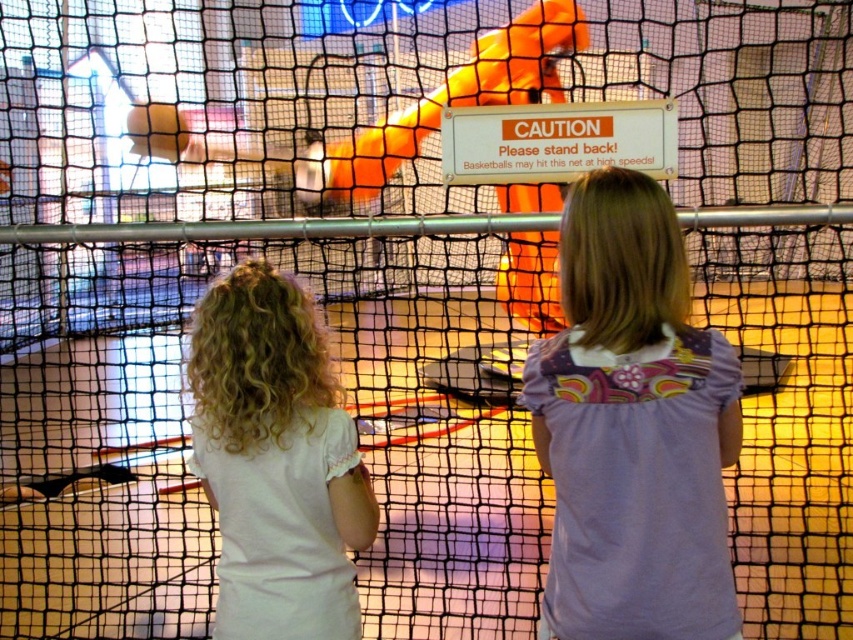
Question: Which object appears farthest from the camera in this image?

Choices:
 (A) purple floral shirt at center
 (B) white cotton shirt at center

Answer: (B)

Question: Does purple floral shirt at center appear on the right side of white cotton shirt at center?

Choices:
 (A) no
 (B) yes

Answer: (B)

Question: Is purple floral shirt at center to the left of white cotton shirt at center from the viewer's perspective?

Choices:
 (A) yes
 (B) no

Answer: (B)

Question: Is purple floral shirt at center wider than white cotton shirt at center?

Choices:
 (A) no
 (B) yes

Answer: (B)